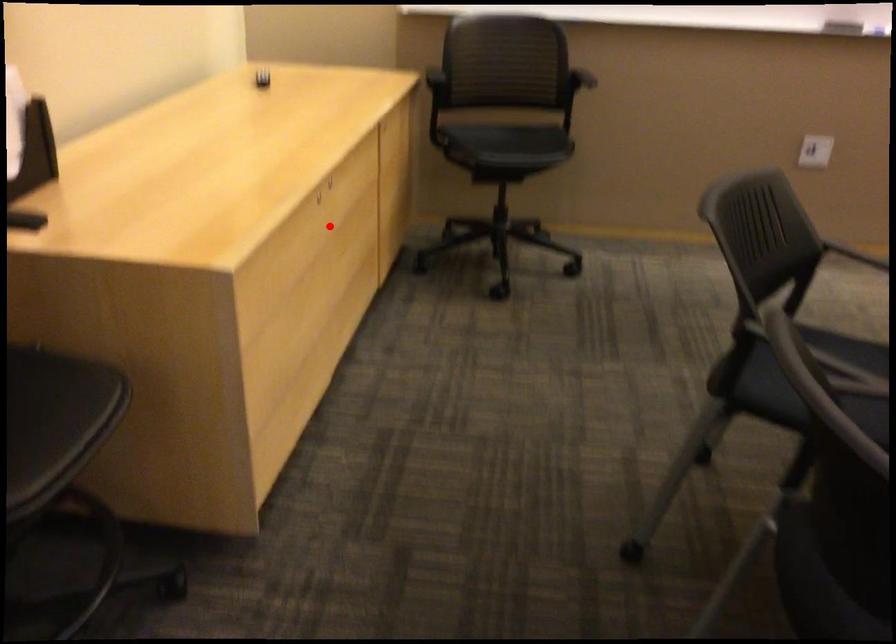
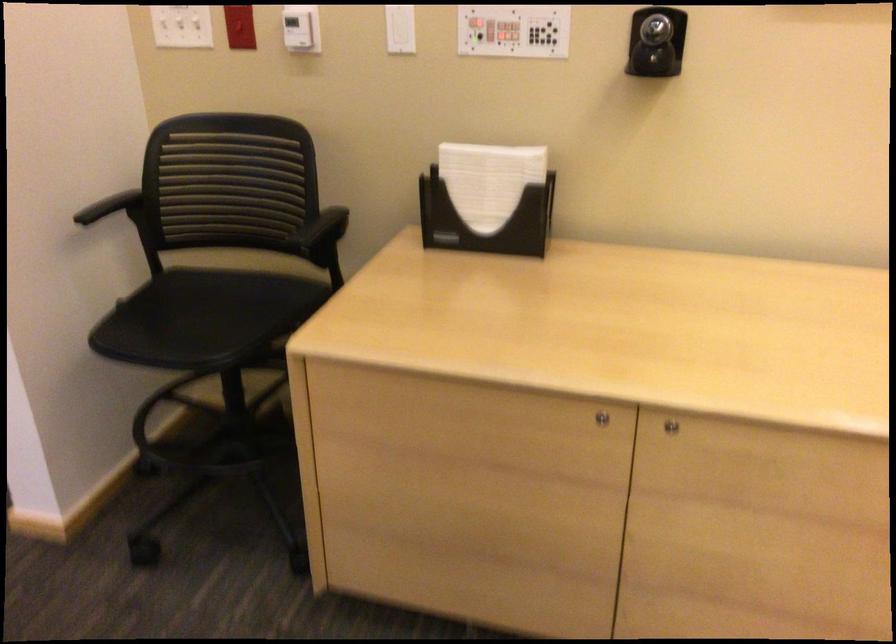
Question: I am providing you with two images of the same scene from different viewpoints. Given a red point in image1, look at the same physical point in image2. Is it:

Choices:
 (A) Closer to the viewpoint
 (B) Farther from the viewpoint

Answer: (A)